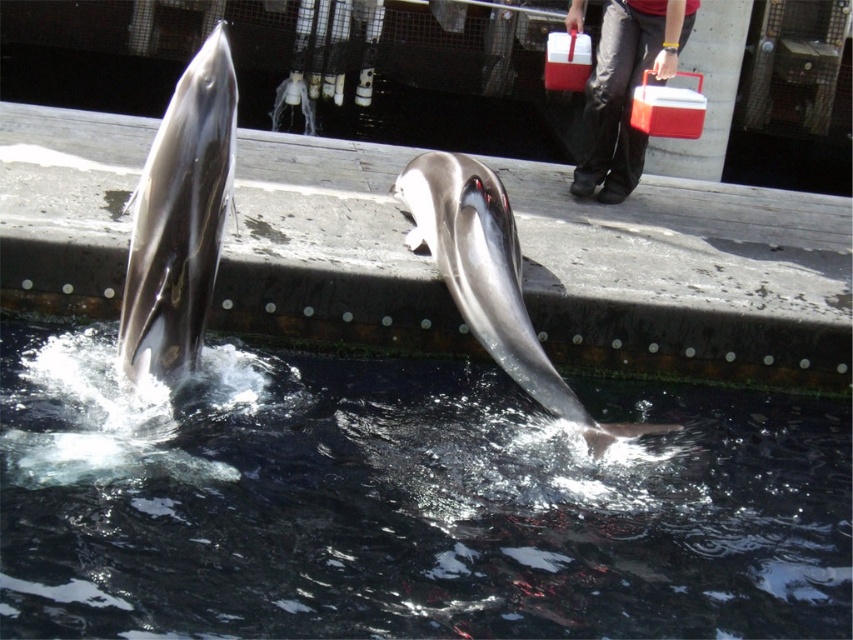
Who is more forward, (492, 193) or (631, 51)?

Point (492, 193) is more forward.

What are the coordinates of `shiny silver dolphin at center` in the screenshot? It's located at (491, 278).

Can you confirm if clear water at center is positioned to the right of shiny silver dolphin at center?

In fact, clear water at center is to the left of shiny silver dolphin at center.

Does clear water at center lie behind shiny silver dolphin at center?

No, it is not.

Identify the location of clear water at center. The width and height of the screenshot is (853, 640). (403, 502).

Is clear water at center shorter than shiny gray dolphin at upper left?

Indeed, clear water at center has a lesser height compared to shiny gray dolphin at upper left.

Is point (764, 525) farther from camera compared to point (222, 168)?

Yes, it is.

Where is `clear water at center`? The height and width of the screenshot is (640, 853). clear water at center is located at coordinates (403, 502).